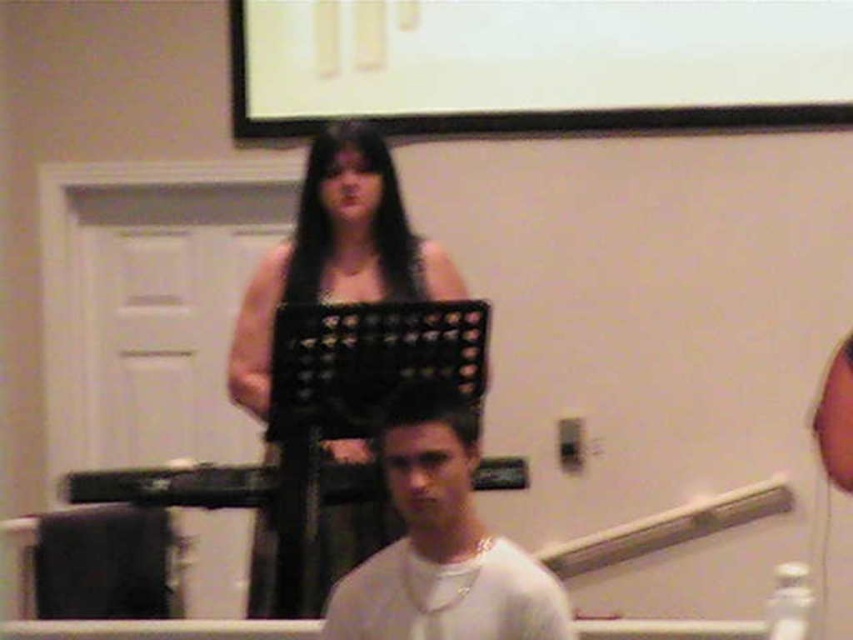
Which is above, black matte music stand at center or white matte shirt at center?

black matte music stand at center

Measure the distance between black matte music stand at center and white matte shirt at center.

They are 20.28 inches apart.

Who is more distant from viewer, (x=328, y=141) or (x=497, y=611)?

Point (x=328, y=141)

Where is `black matte music stand at center`? The width and height of the screenshot is (853, 640). black matte music stand at center is located at coordinates (335, 252).

Does white matte projection screen at upper center appear under black matte music stand at center?

No, white matte projection screen at upper center is not below black matte music stand at center.

Which of these two, white matte projection screen at upper center or black matte music stand at center, stands taller?

black matte music stand at center

Is point (683, 10) positioned behind point (280, 273)?

Yes, point (683, 10) is farther from viewer.

Identify the location of white matte projection screen at upper center. This screenshot has width=853, height=640. (537, 65).

Can you confirm if white matte projection screen at upper center is positioned below white matte shirt at center?

No.

Is point (680, 28) closer to camera compared to point (355, 605)?

No, (680, 28) is behind (355, 605).

Find the location of a particular element. white matte projection screen at upper center is located at coordinates (537, 65).